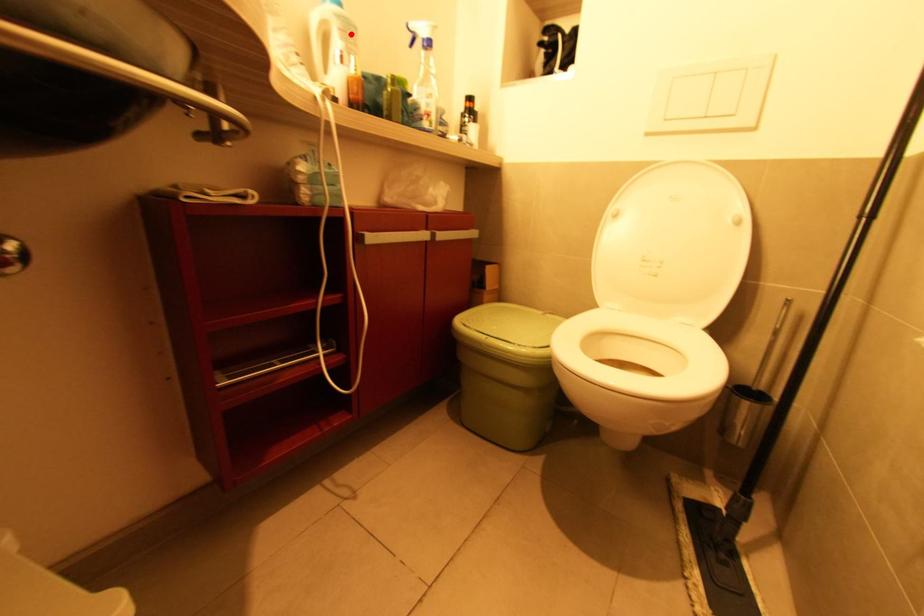
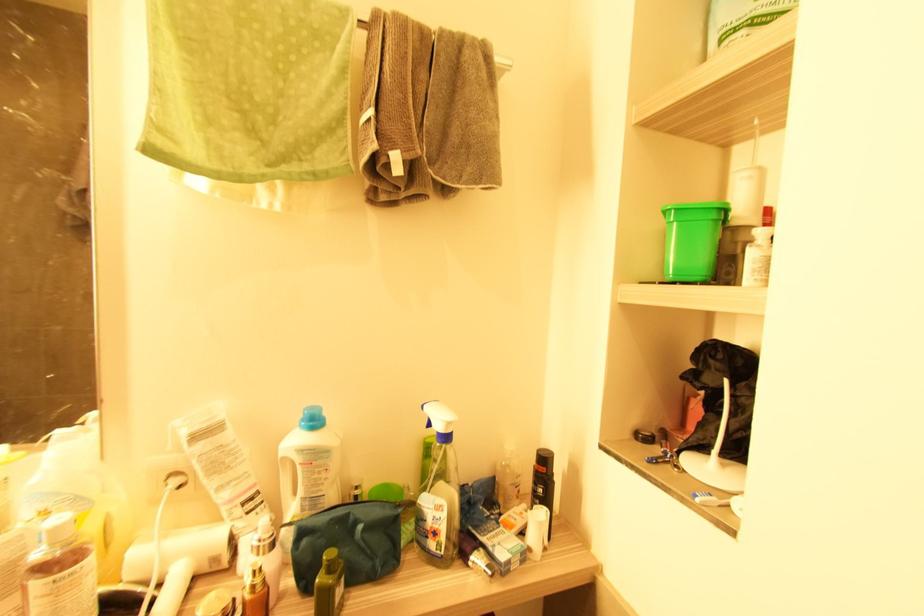
Find the pixel in the second image that matches the highlighted location in the first image.

(315, 464)